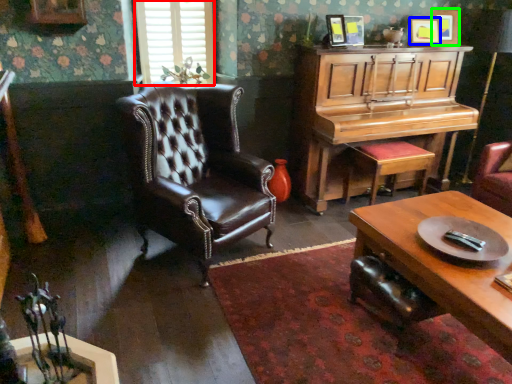
Question: Estimate the real-world distances between objects in this image. Which object is closer to window (highlighted by a red box), picture frame (highlighted by a blue box) or picture frame (highlighted by a green box)?

Choices:
 (A) picture frame
 (B) picture frame

Answer: (A)